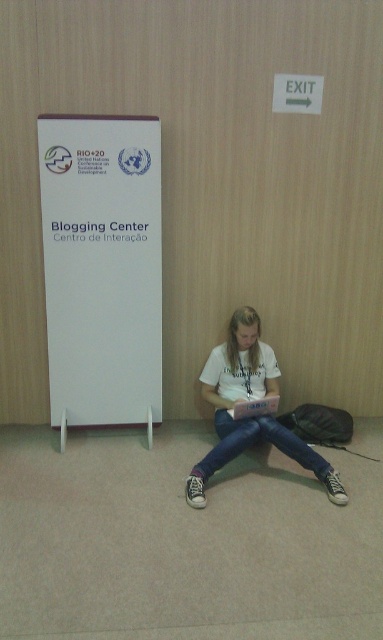
Question: Which point is farther to the camera?

Choices:
 (A) (127, 365)
 (B) (304, 449)

Answer: (A)

Question: Is white paper at left to the left of white cotton shirt at center from the viewer's perspective?

Choices:
 (A) no
 (B) yes

Answer: (B)

Question: Which point is closer to the camera?

Choices:
 (A) white cotton shirt at center
 (B) white paper at left

Answer: (A)

Question: Is white paper at left above white cotton shirt at center?

Choices:
 (A) no
 (B) yes

Answer: (B)

Question: Is white paper at left above white cotton shirt at center?

Choices:
 (A) no
 (B) yes

Answer: (B)